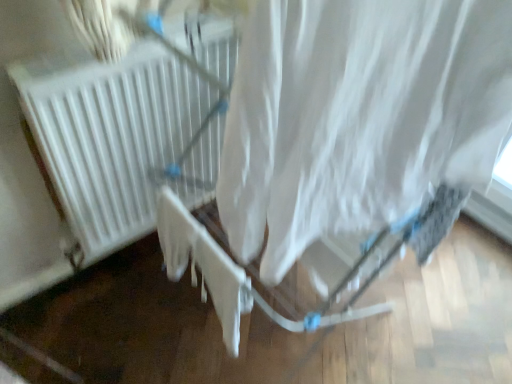
Question: Does white fabric curtain at center lie in front of white matte radiator at center?

Choices:
 (A) no
 (B) yes

Answer: (B)

Question: Can you confirm if white fabric curtain at center is bigger than white matte radiator at center?

Choices:
 (A) yes
 (B) no

Answer: (B)

Question: Is white fabric curtain at center outside of white matte radiator at center?

Choices:
 (A) yes
 (B) no

Answer: (A)

Question: From a real-world perspective, is white fabric curtain at center positioned over white matte radiator at center based on gravity?

Choices:
 (A) no
 (B) yes

Answer: (B)

Question: Are white fabric curtain at center and white matte radiator at center far apart?

Choices:
 (A) yes
 (B) no

Answer: (B)

Question: Does white fabric curtain at center have a greater height compared to white matte radiator at center?

Choices:
 (A) yes
 (B) no

Answer: (B)

Question: Does white matte radiator at center have a smaller size compared to white fabric curtain at center?

Choices:
 (A) no
 (B) yes

Answer: (A)

Question: Is white matte radiator at center not inside white fabric curtain at center?

Choices:
 (A) yes
 (B) no

Answer: (A)

Question: Is white matte radiator at center behind white fabric curtain at center?

Choices:
 (A) no
 (B) yes

Answer: (B)

Question: Is white matte radiator at center next to white fabric curtain at center?

Choices:
 (A) yes
 (B) no

Answer: (B)

Question: Does white matte radiator at center lie in front of white fabric curtain at center?

Choices:
 (A) no
 (B) yes

Answer: (A)

Question: From the image's perspective, does white matte radiator at center appear higher than white fabric curtain at center?

Choices:
 (A) yes
 (B) no

Answer: (A)

Question: In terms of size, does white fabric curtain at center appear bigger or smaller than white matte radiator at center?

Choices:
 (A) big
 (B) small

Answer: (B)